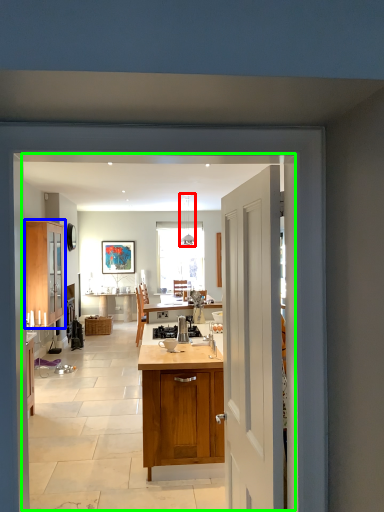
Question: Estimate the real-world distances between objects in this image. Which object is farther from lamp (highlighted by a red box), cabinetry (highlighted by a blue box) or residence (highlighted by a green box)?

Choices:
 (A) cabinetry
 (B) residence

Answer: (A)